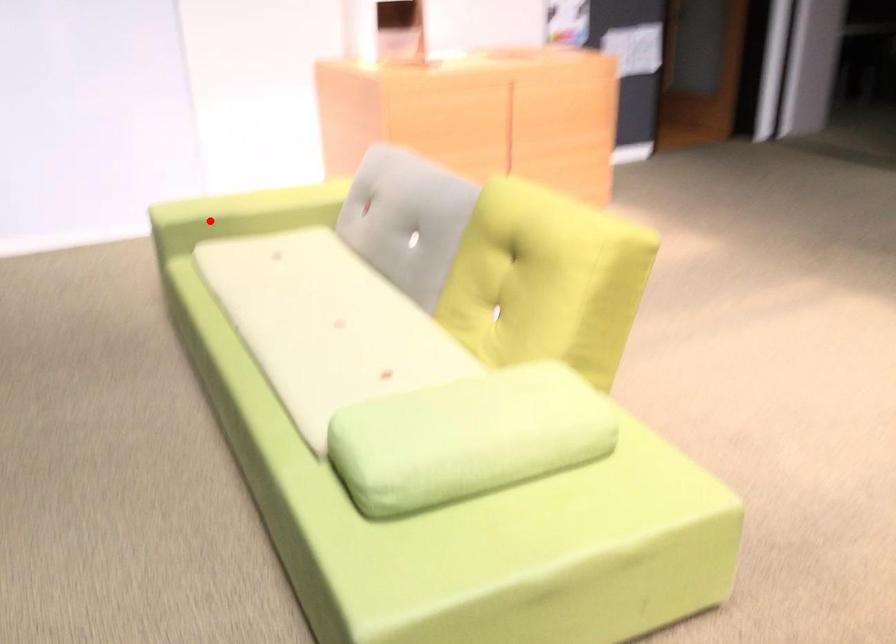
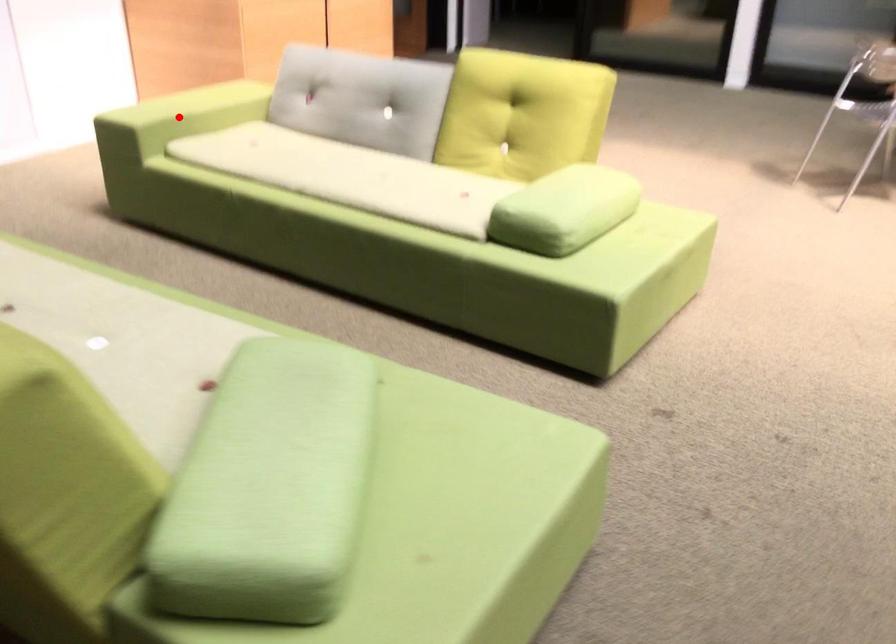
From the picture: I am providing you with two images of the same scene from different viewpoints. A red point is marked on the first image and another point is marked on the second image. Is the red point in image1 aligned with the point shown in image2?

Yes